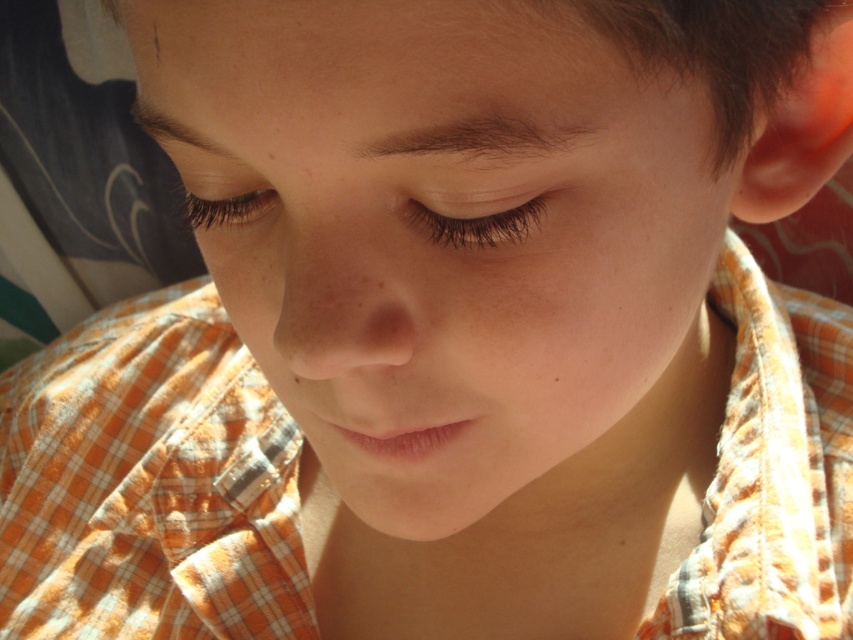
Who is more distant from viewer, (424,218) or (247,193)?

The point (247,193) is more distant.

Which of these two, brown matte eyelashes at center or black eyelashes at upper left, stands taller?

black eyelashes at upper left is taller.

Does point (445, 244) come behind point (206, 200)?

No.

Where is `brown matte eyelashes at center`? The height and width of the screenshot is (640, 853). brown matte eyelashes at center is located at coordinates (474, 225).